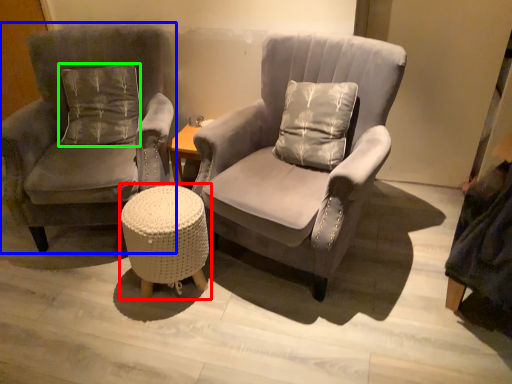
Question: Based on their relative distances, which object is nearer to music stool (highlighted by a red box)? Choose from chair (highlighted by a blue box) and pillow (highlighted by a green box).

Choices:
 (A) chair
 (B) pillow

Answer: (A)